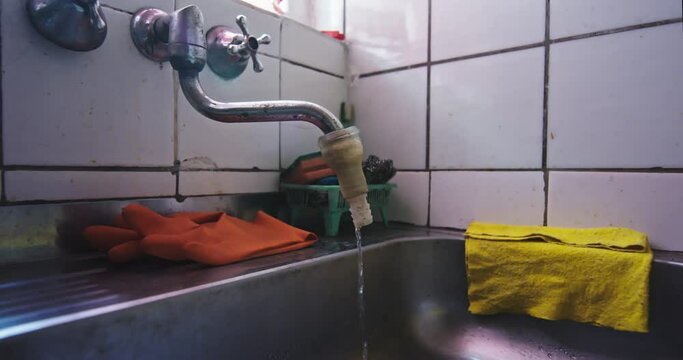
Locate an element on the screen. This screenshot has width=683, height=360. sponge is located at coordinates (404, 181).